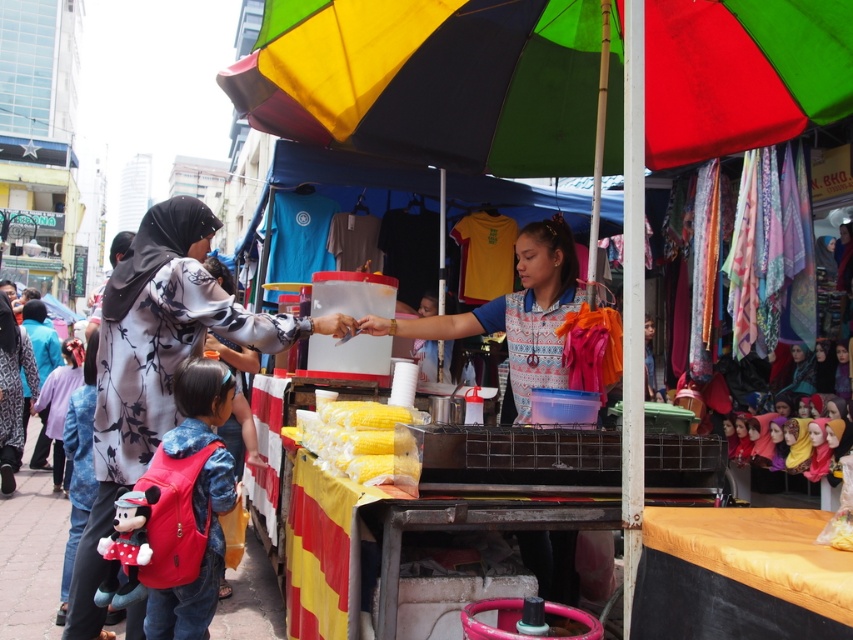
Between matte blue shirt at center and yellow matte corn at center, which one has less height?

Standing shorter between the two is yellow matte corn at center.

Looking at this image, who is more distant from viewer, (541, 230) or (363, 470)?

The point (541, 230) is more distant.

Identify the location of matte blue shirt at center. Image resolution: width=853 pixels, height=640 pixels. (515, 312).

Between point (440, 1) and point (199, 244), which one is positioned in front?

Positioned in front is point (199, 244).

Which is more to the left, rainbow fabric umbrella at center or floral fabric hijab at left?

floral fabric hijab at left

Which is in front, point (397, 104) or point (175, 234)?

Point (175, 234)

Locate an element on the screen. The height and width of the screenshot is (640, 853). rainbow fabric umbrella at center is located at coordinates (438, 81).

Can you confirm if red fabric backpack at lower left is thinner than matte blue shirt at center?

Yes.

Does point (161, 572) come closer to viewer compared to point (544, 371)?

Yes, it is in front of point (544, 371).

Between point (200, 618) and point (540, 332), which one is positioned behind?

The point (540, 332) is behind.

Identify the location of red fabric backpack at lower left. The height and width of the screenshot is (640, 853). (189, 506).